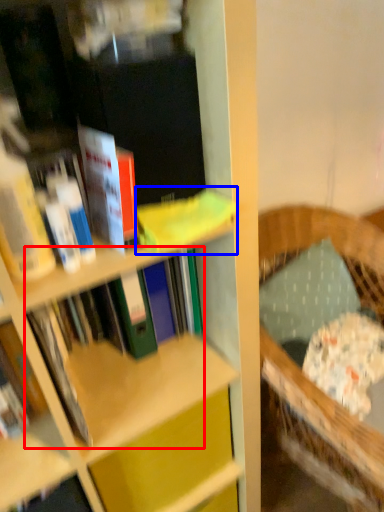
Question: Which of the following is the closest to the observer, book (highlighted by a red box) or book (highlighted by a blue box)?

Choices:
 (A) book
 (B) book

Answer: (B)